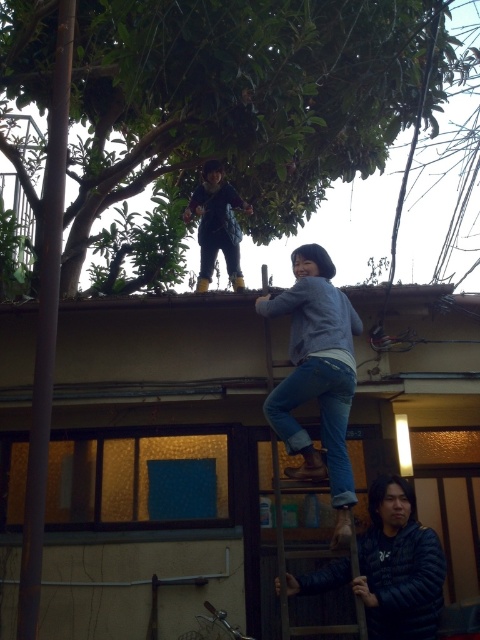
Question: Which object is positioned closest to the matte black jacket at upper center?

Choices:
 (A) wooden at upper center
 (B) dark blue padded jacket at lower right

Answer: (A)

Question: Which of the following is the farthest from the observer?

Choices:
 (A) (237, 268)
 (B) (406, 609)
 (C) (291, 557)
 (D) (355, 20)

Answer: (A)

Question: Can you confirm if green leafy tree at upper center is positioned to the right of dark blue padded jacket at lower right?

Choices:
 (A) yes
 (B) no

Answer: (B)

Question: Does green leafy tree at upper center have a lesser width compared to matte black jacket at upper center?

Choices:
 (A) yes
 (B) no

Answer: (B)

Question: Does dark blue padded jacket at lower right appear on the right side of wooden at upper center?

Choices:
 (A) yes
 (B) no

Answer: (A)

Question: Which of the following is the farthest from the observer?

Choices:
 (A) (375, 570)
 (B) (237, 208)
 (C) (219, 72)
 (D) (280, 564)

Answer: (B)